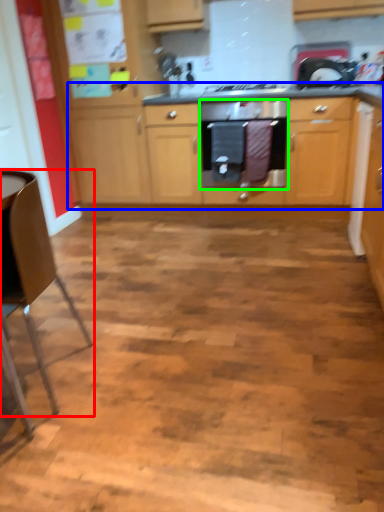
Question: Estimate the real-world distances between objects in this image. Which object is farther from chair (highlighted by a red box), cabinetry (highlighted by a blue box) or home appliance (highlighted by a green box)?

Choices:
 (A) cabinetry
 (B) home appliance

Answer: (A)